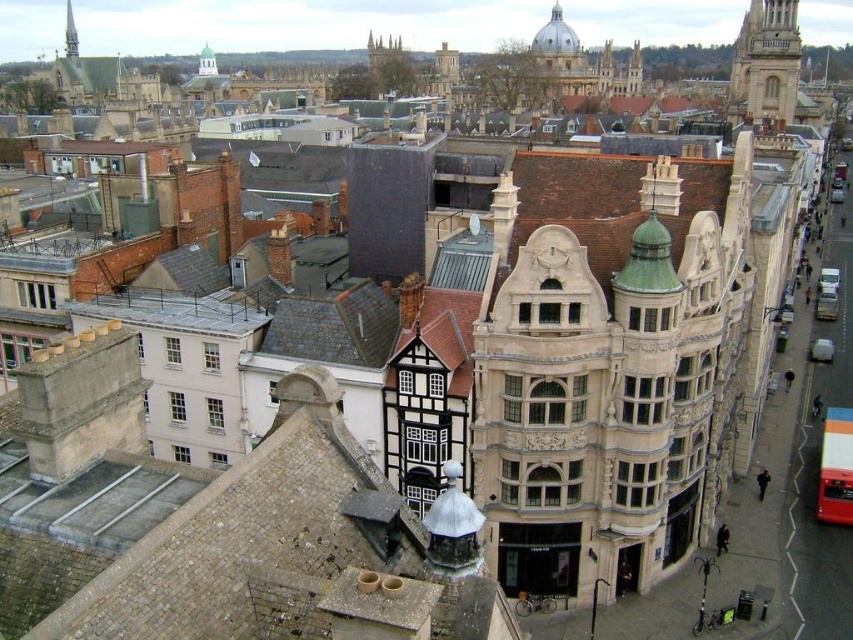
Question: Does beige stone building at center come in front of stone tower at upper right?

Choices:
 (A) no
 (B) yes

Answer: (B)

Question: Based on their relative distances, which object is farther from the beige stone building at center?

Choices:
 (A) smooth silver spire at upper left
 (B) stone tower at upper right

Answer: (A)

Question: Does beige stone building at center appear over stone tower at upper right?

Choices:
 (A) no
 (B) yes

Answer: (A)

Question: Does beige stone building at center come in front of smooth silver spire at upper left?

Choices:
 (A) no
 (B) yes

Answer: (B)

Question: Which of the following is the farthest from the observer?

Choices:
 (A) (67, 22)
 (B) (676, 410)
 (C) (788, 33)

Answer: (A)

Question: Which is farther from the stone tower at upper right?

Choices:
 (A) beige stone building at center
 (B) smooth silver spire at upper left

Answer: (B)